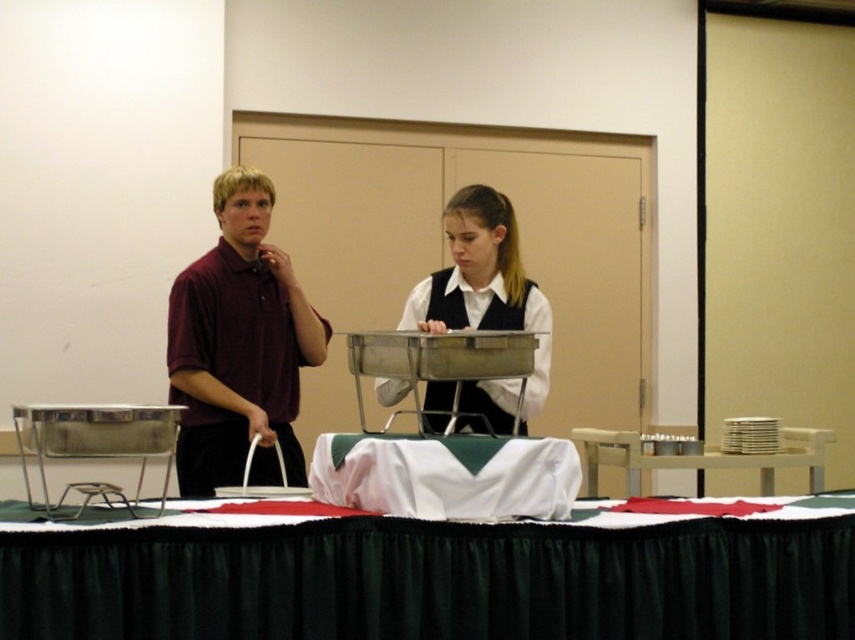
Question: Can you confirm if white satin tablecloth at center is positioned below white glossy vest at center?

Choices:
 (A) no
 (B) yes

Answer: (B)

Question: Considering the real-world distances, which object is closest to the white glossy vest at center?

Choices:
 (A) black fabric table at lower center
 (B) maroon fabric shirt at left

Answer: (B)

Question: Does white glossy vest at center have a greater width compared to white wood table at right?

Choices:
 (A) no
 (B) yes

Answer: (A)

Question: Which of the following is the closest to the observer?

Choices:
 (A) (510, 484)
 (B) (503, 428)
 (C) (700, 468)

Answer: (A)

Question: Among these points, which one is nearest to the camera?

Choices:
 (A) (478, 291)
 (B) (205, 435)
 (C) (52, 627)
 (D) (802, 429)

Answer: (C)

Question: Can you confirm if white glossy vest at center is positioned to the left of white wood table at right?

Choices:
 (A) yes
 (B) no

Answer: (A)